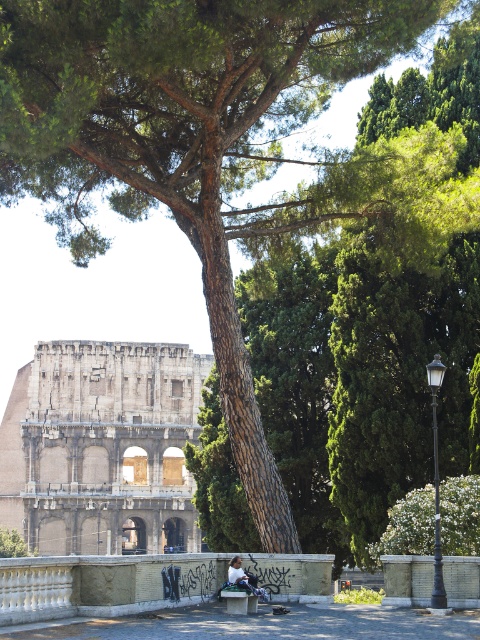
In the scene shown: Is stone amphitheater at center positioned at the back of wooden park bench at center?

Yes, it is.

This screenshot has width=480, height=640. Find the location of `stone amphitheater at center`. stone amphitheater at center is located at coordinates (103, 448).

Is white fabric bag at lower center thinner than wooden park bench at center?

Correct, white fabric bag at lower center's width is less than wooden park bench at center's.

Is point (236, 576) in front of point (228, 608)?

No, (236, 576) is behind (228, 608).

Is point (230, 580) behind point (235, 612)?

Yes, point (230, 580) is farther from viewer.

At what (x,y) coordinates should I click in order to perform the action: click on white fabric bag at lower center. Please return your answer as a coordinate pair (x, y). The height and width of the screenshot is (640, 480). Looking at the image, I should click on (243, 579).

Based on the photo, can you confirm if stone amphitheater at center is wider than white fabric bag at lower center?

Correct, the width of stone amphitheater at center exceeds that of white fabric bag at lower center.

The image size is (480, 640). What do you see at coordinates (103, 448) in the screenshot?
I see `stone amphitheater at center` at bounding box center [103, 448].

Locate an element on the screen. The width and height of the screenshot is (480, 640). stone amphitheater at center is located at coordinates (103, 448).